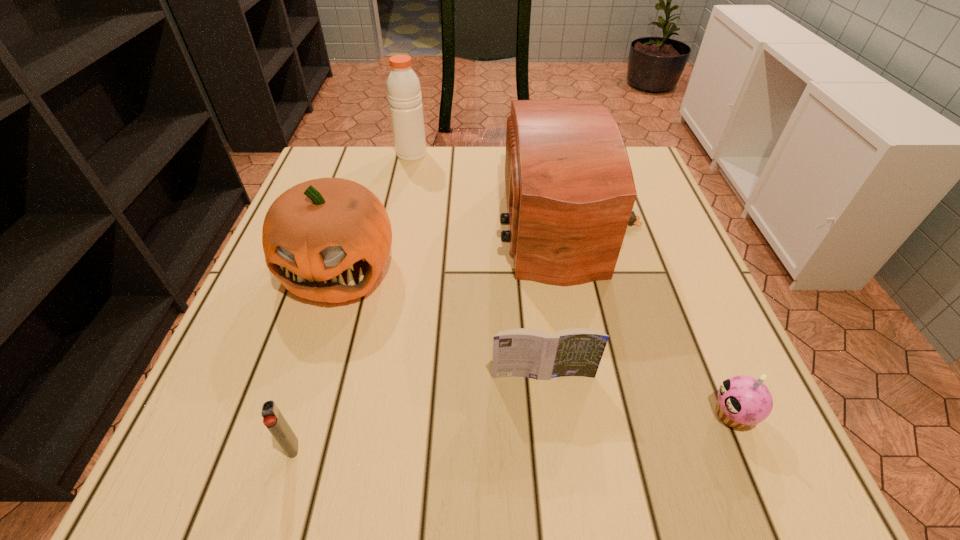
In order to click on free region at the far left corner in this screenshot , I will do `click(339, 152)`.

This screenshot has height=540, width=960. I want to click on free space at the near left corner of the desktop, so (212, 435).

Locate an element on the screen. vacant area at the near right corner is located at coordinates (751, 442).

You are a GUI agent. You are given a task and a screenshot of the screen. Output one action in this format:
    pyautogui.click(x=<x>, y=<y>)
    Task: Click on the empty location between the nearest object and the radio receiver
    This screenshot has width=960, height=540.
    Given the screenshot: What is the action you would take?
    pyautogui.click(x=431, y=335)

Locate an element on the screen. free space between the nearest object and the farthest object is located at coordinates (352, 301).

Find the location of a particular element. vacant point located between the fourth farthest object and the fourth shortest object is located at coordinates (442, 321).

This screenshot has width=960, height=540. Find the location of `free space that is in between the farthest object and the fourth farthest object`. free space that is in between the farthest object and the fourth farthest object is located at coordinates (477, 265).

Locate an element on the screen. The width and height of the screenshot is (960, 540). vacant area that lies between the cupcake and the nearest object is located at coordinates (513, 431).

Locate an element on the screen. empty space between the radio receiver and the book is located at coordinates pos(556,299).

Identify the location of vacant space that is in between the third tallest object and the third nearest object. Image resolution: width=960 pixels, height=540 pixels. (442, 321).